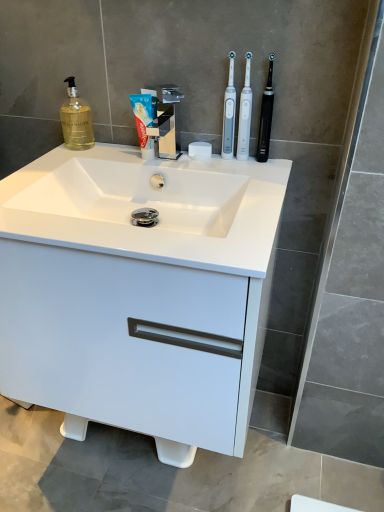
Where is `vacant space situated on the left part of white plastic toothbrush at upper right, the second toothbrush viewed from the left`? vacant space situated on the left part of white plastic toothbrush at upper right, the second toothbrush viewed from the left is located at coordinates (187, 161).